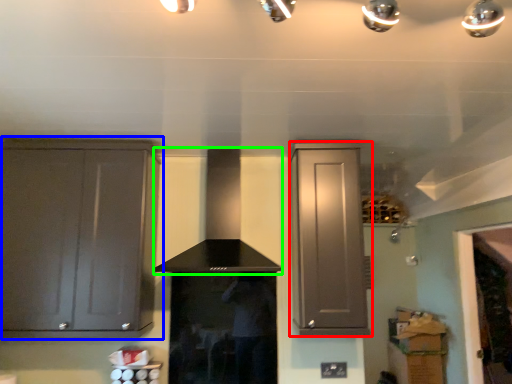
Question: Based on their relative distances, which object is farther from cabinetry (highlighted by a red box)? Choose from cabinetry (highlighted by a blue box) and vent (highlighted by a green box).

Choices:
 (A) cabinetry
 (B) vent

Answer: (A)